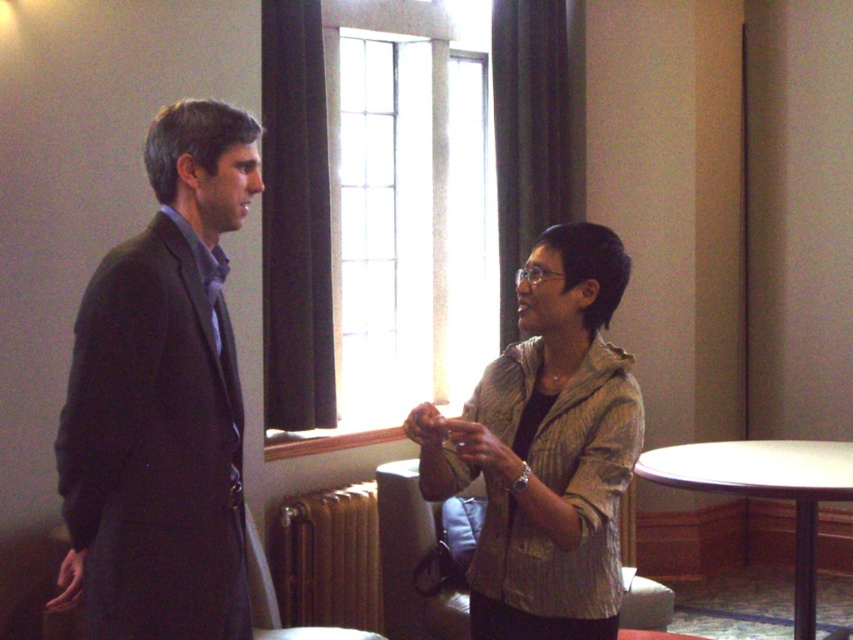
You are standing in the room and want to place a small potted plant between the textured beige jacket at center and the gold metallic radiator at lower center. Based on their positions, which object should the plant be closer to?

The textured beige jacket at center is positioned on the right side of the gold metallic radiator at lower center, so the plant should be placed closer to the gold metallic radiator at lower center to be between them.

You are an interior designer assessing the spatial arrangement of the room. You notice the dark gray suit at left and the textured beige jacket at center. Which object is closer to the window with the grid pattern?

The dark gray suit at left is closer to the window with the grid pattern because it is in front of the textured beige jacket at center.

You are a guest in the room and want to place a small plant on the table. Can you place it on the white wood table at lower right without blocking the gold metallic radiator at lower center?

The gold metallic radiator at lower center is located below the white wood table at lower right, so placing the plant on the white wood table at lower right will not block the radiator since it is positioned below the table.